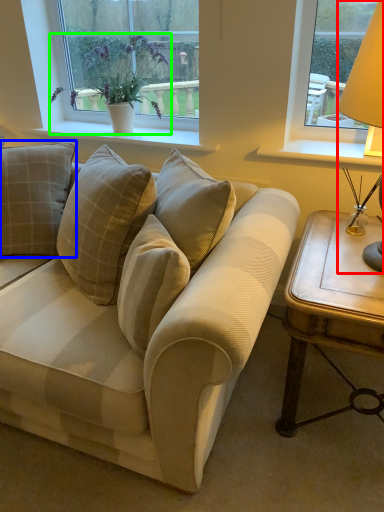
Question: Which object is the closest to the table lamp (highlighted by a red box)? Choose among these: pillow (highlighted by a blue box) or houseplant (highlighted by a green box).

Choices:
 (A) pillow
 (B) houseplant

Answer: (B)